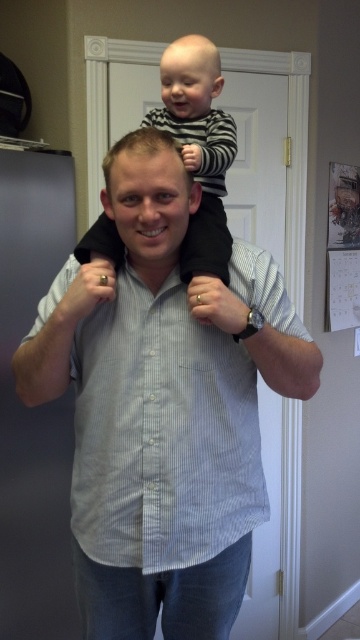
Question: Does light blue striped shirt at center appear under striped cotton shirt at upper center?

Choices:
 (A) yes
 (B) no

Answer: (A)

Question: Is light blue striped shirt at center closer to the viewer compared to striped cotton shirt at upper center?

Choices:
 (A) yes
 (B) no

Answer: (A)

Question: Among these points, which one is farthest from the camera?

Choices:
 (A) (258, 429)
 (B) (225, 172)

Answer: (B)

Question: Where is light blue striped shirt at center located in relation to striped cotton shirt at upper center in the image?

Choices:
 (A) above
 (B) below

Answer: (B)